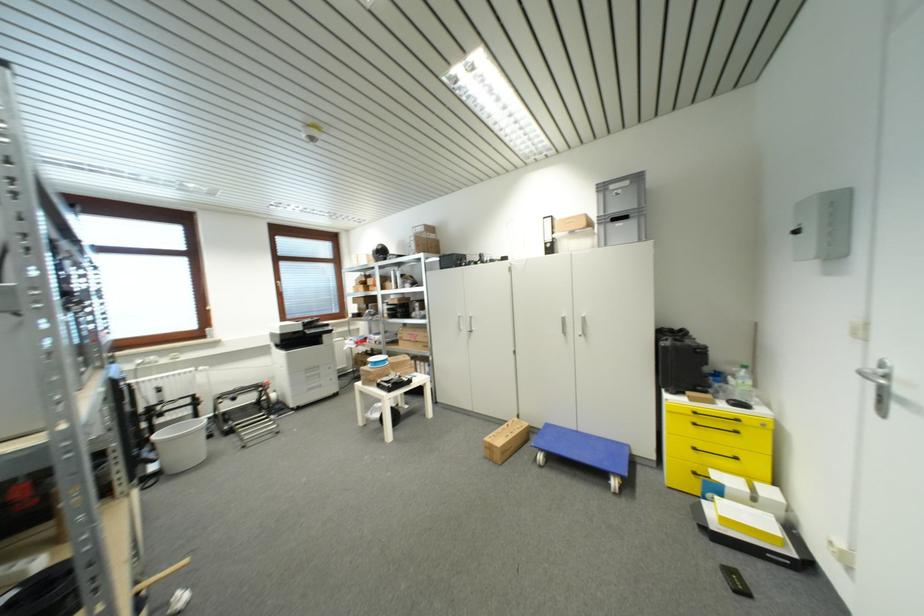
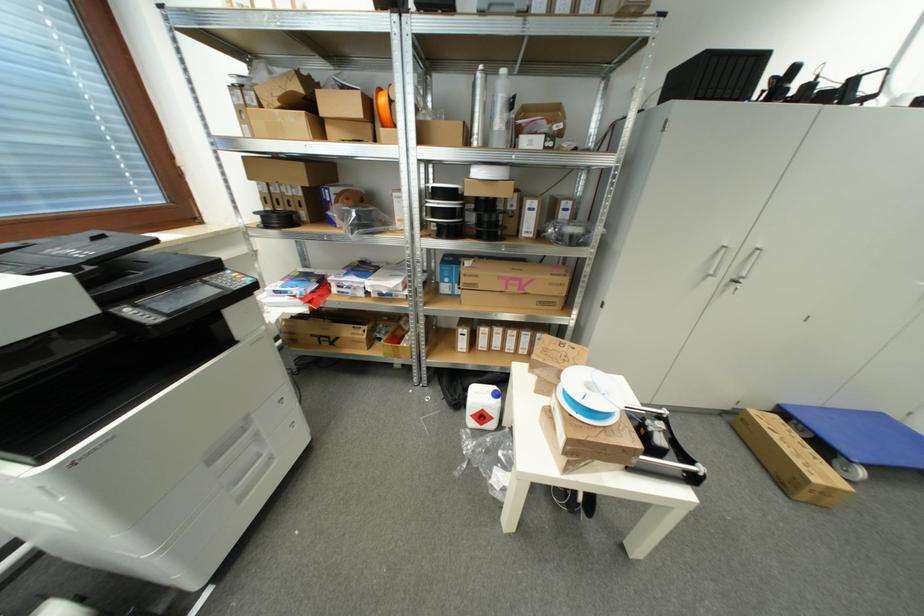
Where in the second image is the point corresponding to the point at 633,448 from the first image?

(885, 418)